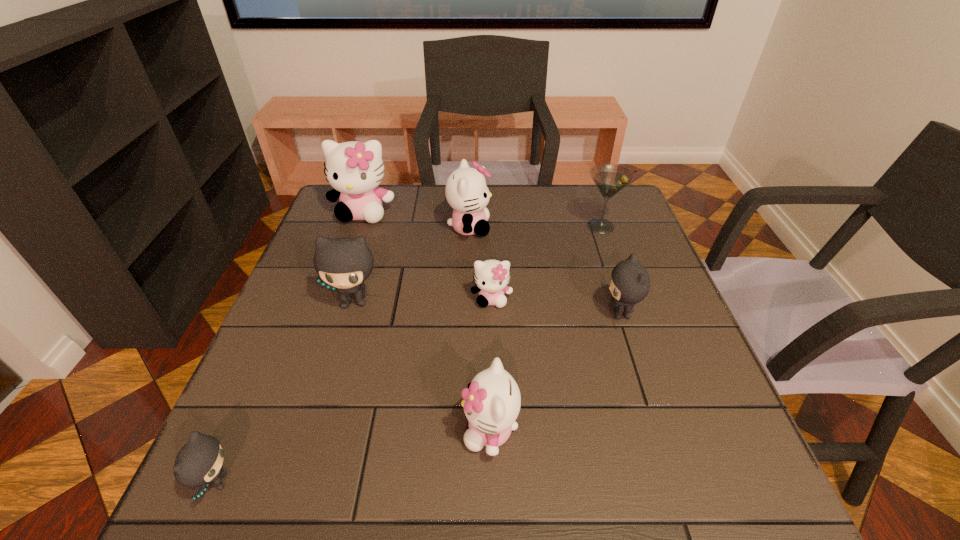
Identify the location of empty location between the nearest gray kitten and the smallest white kitten. (354, 390).

At what (x,y) coordinates should I click in order to perform the action: click on free spot between the third smallest white kitten and the biggest white kitten. Please return your answer as a coordinate pair (x, y). Image resolution: width=960 pixels, height=540 pixels. Looking at the image, I should click on (417, 220).

Image resolution: width=960 pixels, height=540 pixels. In order to click on free space between the leftmost white kitten and the nearest white kitten in this screenshot , I will do `click(426, 321)`.

What are the coordinates of `free space between the smallest white kitten and the rightmost kitten` in the screenshot? It's located at pyautogui.click(x=556, y=306).

Identify which object is the second closest to the second gray kitten from right to left. Please provide its 2D coordinates. Your answer should be formatted as a tuple, i.e. [(x, y)], where the tuple contains the x and y coordinates of a point satisfying the conditions above.

[(466, 190)]

Where is `object that is the seventh nearest to the second biggest white kitten`? The width and height of the screenshot is (960, 540). object that is the seventh nearest to the second biggest white kitten is located at coordinates pyautogui.click(x=199, y=462).

Where is `kitten identified as the fifth closest to the second biggest white kitten`? kitten identified as the fifth closest to the second biggest white kitten is located at coordinates (492, 401).

Identify which kitten is the fifth closest to the rightmost gray kitten. Please provide its 2D coordinates. Your answer should be formatted as a tuple, i.e. [(x, y)], where the tuple contains the x and y coordinates of a point satisfying the conditions above.

[(354, 169)]

The height and width of the screenshot is (540, 960). What are the coordinates of `the third closest white kitten relative to the tallest object` in the screenshot? It's located at (492, 401).

Find the location of a particular element. white kitten identified as the third closest to the second smallest white kitten is located at coordinates pos(354,169).